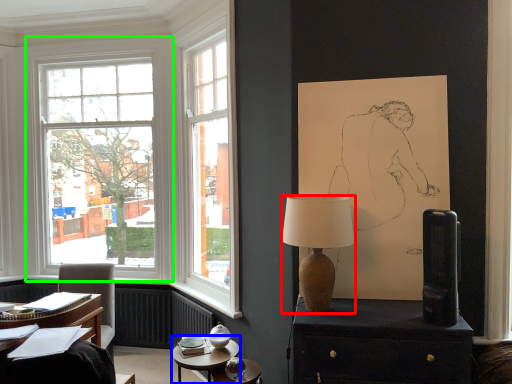
Question: Which object is the farthest from lamp (highlighted by a red box)? Choose among these: table (highlighted by a blue box) or window (highlighted by a green box).

Choices:
 (A) table
 (B) window

Answer: (B)